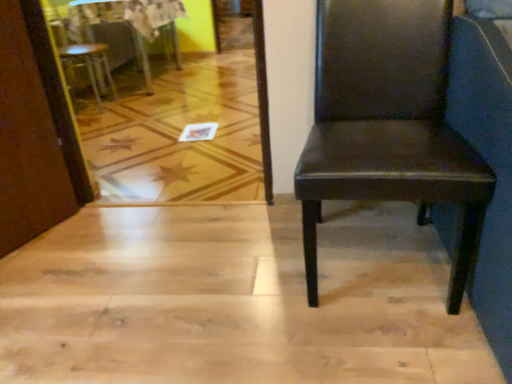
Find the location of a particular element. This screenshot has width=512, height=384. matte brown leather chair at right, placed as the 1th chair when sorted from bottom to top is located at coordinates (387, 123).

Locate an element on the screen. The width and height of the screenshot is (512, 384). matte brown chair at upper left, positioned as the second chair in bottom-to-top order is located at coordinates (88, 64).

Is matte brown chair at upper left, the 1th chair viewed from the left, taller than wooden table at upper left?

Correct, matte brown chair at upper left, the 1th chair viewed from the left, is much taller as wooden table at upper left.

Does matte brown chair at upper left, marked as the first chair in a top-to-bottom arrangement, turn towards wooden table at upper left?

Yes, matte brown chair at upper left, marked as the first chair in a top-to-bottom arrangement, is aimed at wooden table at upper left.

Who is smaller, matte brown chair at upper left, which appears as the 1th chair when viewed from the back, or wooden table at upper left?

matte brown chair at upper left, which appears as the 1th chair when viewed from the back, is smaller.

How many degrees apart are the facing directions of matte brown chair at upper left, marked as the first chair in a top-to-bottom arrangement, and matte brown leather chair at right, placed as the 1th chair when sorted from bottom to top?

matte brown chair at upper left, marked as the first chair in a top-to-bottom arrangement, and matte brown leather chair at right, placed as the 1th chair when sorted from bottom to top, are facing 174 degrees away from each other.

Which object is closer to the camera taking this photo, matte brown chair at upper left, marked as the first chair in a top-to-bottom arrangement, or matte brown leather chair at right, placed as the 2th chair when sorted from top to bottom?

Positioned in front is matte brown leather chair at right, placed as the 2th chair when sorted from top to bottom.

Would you say matte brown chair at upper left, marked as the first chair in a top-to-bottom arrangement, is outside matte brown leather chair at right, acting as the 1th chair starting from the right?

Yes.

Looking at this image, considering the sizes of matte brown chair at upper left, arranged as the second chair when viewed from the front, and matte brown leather chair at right, which ranks as the 2th chair in back-to-front order, in the image, is matte brown chair at upper left, arranged as the second chair when viewed from the front, taller or shorter than matte brown leather chair at right, which ranks as the 2th chair in back-to-front order,?

matte brown chair at upper left, arranged as the second chair when viewed from the front, is shorter than matte brown leather chair at right, which ranks as the 2th chair in back-to-front order.

Considering the positions of objects matte brown leather chair at right, placed as the 2th chair when sorted from top to bottom, and matte brown chair at upper left, the 1th chair viewed from the left, in the image provided, who is more to the left, matte brown leather chair at right, placed as the 2th chair when sorted from top to bottom, or matte brown chair at upper left, the 1th chair viewed from the left,?

Positioned to the left is matte brown chair at upper left, the 1th chair viewed from the left.

Considering the sizes of objects matte brown leather chair at right, the 2th chair from the left, and matte brown chair at upper left, positioned as the second chair in bottom-to-top order, in the image provided, who is taller, matte brown leather chair at right, the 2th chair from the left, or matte brown chair at upper left, positioned as the second chair in bottom-to-top order,?

matte brown leather chair at right, the 2th chair from the left.

Based on the photo, is wooden table at upper left thinner than matte brown chair at upper left, the 1th chair viewed from the left?

No.

Is the surface of wooden table at upper left in direct contact with matte brown chair at upper left, positioned as the second chair in bottom-to-top order?

No, wooden table at upper left is not with matte brown chair at upper left, positioned as the second chair in bottom-to-top order.

From the image's perspective, is wooden table at upper left located above or below matte brown chair at upper left, marked as the first chair in a top-to-bottom arrangement?

Clearly, from the image's perspective, wooden table at upper left is above matte brown chair at upper left, marked as the first chair in a top-to-bottom arrangement.

Could you measure the distance between wooden table at upper left and matte brown chair at upper left, which appears as the 1th chair when viewed from the back?

wooden table at upper left and matte brown chair at upper left, which appears as the 1th chair when viewed from the back, are 10.71 inches apart.

Find the location of a particular element. This screenshot has width=512, height=384. chair on the right of wooden table at upper left is located at coordinates (387, 123).

Can you confirm if wooden table at upper left is positioned to the right of matte brown leather chair at right, acting as the 1th chair starting from the right?

In fact, wooden table at upper left is to the left of matte brown leather chair at right, acting as the 1th chair starting from the right.

From a real-world perspective, which object stands above the other?

matte brown leather chair at right, acting as the 1th chair starting from the right.

Would you consider wooden table at upper left to be distant from matte brown leather chair at right, the 2th chair from the left?

Yes, wooden table at upper left and matte brown leather chair at right, the 2th chair from the left, are located far from each other.

At what (x,y) coordinates should I click in order to perform the action: click on the 2nd chair above the wooden table at upper left (from a real-world perspective). Please return your answer as a coordinate pair (x, y). Looking at the image, I should click on (387, 123).

Looking at this image, would you say matte brown leather chair at right, acting as the 1th chair starting from the right, contains wooden table at upper left?

No, wooden table at upper left is not inside matte brown leather chair at right, acting as the 1th chair starting from the right.

Is point (463, 167) more distant than point (165, 40)?

That is False.

Who is taller, matte brown leather chair at right, which appears as the 1th chair when viewed from the front, or wooden table at upper left?

matte brown leather chair at right, which appears as the 1th chair when viewed from the front, is taller.

Locate an element on the screen. The image size is (512, 384). chair that is the 1st object located below the wooden table at upper left (from the image's perspective) is located at coordinates (88, 64).

Locate an element on the screen. Image resolution: width=512 pixels, height=384 pixels. chair below the matte brown leather chair at right, the 2th chair from the left (from a real-world perspective) is located at coordinates (88, 64).

When comparing their distances from wooden table at upper left, does matte brown chair at upper left, arranged as the second chair when viewed from the front, or matte brown leather chair at right, placed as the 1th chair when sorted from bottom to top, seem closer?

The object closer to wooden table at upper left is matte brown chair at upper left, arranged as the second chair when viewed from the front.

Looking at this image, based on their spatial positions, is wooden table at upper left or matte brown leather chair at right, placed as the 2th chair when sorted from top to bottom, closer to matte brown chair at upper left, the 1th chair viewed from the left?

wooden table at upper left is positioned closer to the anchor matte brown chair at upper left, the 1th chair viewed from the left.

Considering their positions, is wooden table at upper left positioned closer to matte brown leather chair at right, the 2th chair from the left, than matte brown chair at upper left, which appears as the 1th chair when viewed from the back?

matte brown chair at upper left, which appears as the 1th chair when viewed from the back, lies closer to matte brown leather chair at right, the 2th chair from the left, than the other object.

From the image, which object appears to be farther from matte brown chair at upper left, marked as the first chair in a top-to-bottom arrangement, matte brown leather chair at right, which ranks as the 2th chair in back-to-front order, or wooden table at upper left?

matte brown leather chair at right, which ranks as the 2th chair in back-to-front order, is positioned further to the anchor matte brown chair at upper left, marked as the first chair in a top-to-bottom arrangement.

Which object lies further to the anchor point wooden table at upper left, matte brown leather chair at right, which appears as the 1th chair when viewed from the front, or matte brown chair at upper left, which appears as the 1th chair when viewed from the back?

matte brown leather chair at right, which appears as the 1th chair when viewed from the front.

Considering their positions, is matte brown chair at upper left, the 1th chair viewed from the left, positioned further to matte brown leather chair at right, which appears as the 1th chair when viewed from the front, than wooden table at upper left?

wooden table at upper left is further to matte brown leather chair at right, which appears as the 1th chair when viewed from the front.

Locate an element on the screen. chair between matte brown leather chair at right, which appears as the 1th chair when viewed from the front, and wooden table at upper left, along the z-axis is located at coordinates (88, 64).